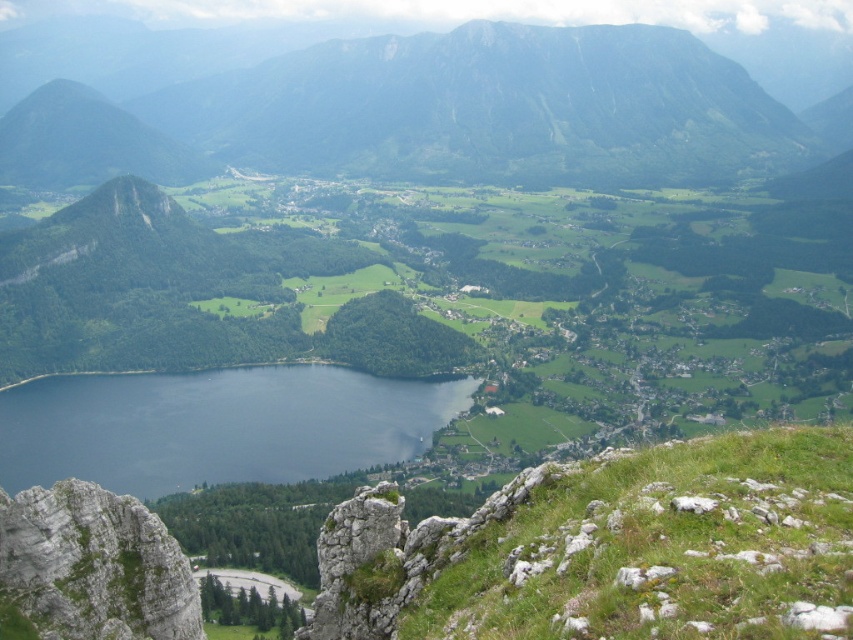
Question: Which object appears closest to the camera in this image?

Choices:
 (A) dark blue water at center
 (B) green grassy mountain at upper center

Answer: (A)

Question: From the image, what is the correct spatial relationship of green grassy mountain at upper center in relation to dark blue water at center?

Choices:
 (A) left
 (B) right

Answer: (B)

Question: Considering the relative positions of green grassy mountain at upper center and dark blue water at center in the image provided, where is green grassy mountain at upper center located with respect to dark blue water at center?

Choices:
 (A) below
 (B) above

Answer: (B)

Question: Is green grassy mountain at upper center to the right of dark blue water at center from the viewer's perspective?

Choices:
 (A) yes
 (B) no

Answer: (A)

Question: Which object appears closest to the camera in this image?

Choices:
 (A) dark blue water at center
 (B) green grassy mountain at upper center

Answer: (A)

Question: Among these objects, which one is farthest from the camera?

Choices:
 (A) green grassy mountain at upper center
 (B) dark blue water at center

Answer: (A)